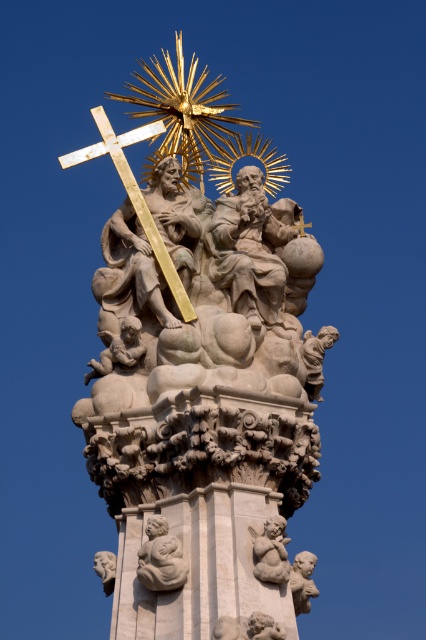
You are standing in front of a religious monument with a golden cross at the top. There is a point marked at coordinates (x=201, y=378). Which object does this point correspond to?

The point at coordinates (x=201, y=378) corresponds to the white stone sculpture at center.

You are an art student analyzing the sculpture. You notice the gold polished cross at upper center and the smooth stone cherub at lower left. Which object appears closer to you in the artwork?

The gold polished cross at upper center appears closer to you because it is positioned further to the viewer than the smooth stone cherub at lower left.

You are an art conservator assessing the spatial arrangement of the monument. Considering the white stone sculpture at center and the smooth stone cherub at lower left, which object occupies more horizontal space in the composition?

The white stone sculpture at center occupies more horizontal space than the smooth stone cherub at lower left because its width is larger.